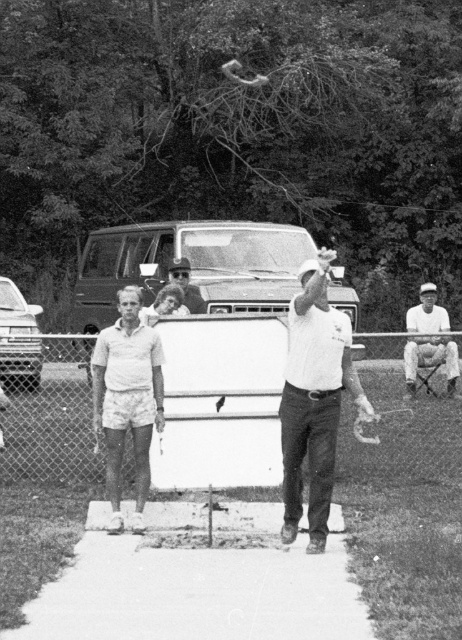
Is white fabric shirt at right bigger than smooth plastic sunglasses at center?

Actually, white fabric shirt at right might be smaller than smooth plastic sunglasses at center.

Measure the distance between point (447, 326) and camera.

Point (447, 326) and camera are 12.52 meters apart from each other.

Is point (445, 371) behind point (187, 296)?

That is True.

Locate an element on the screen. Image resolution: width=462 pixels, height=640 pixels. white fabric shirt at right is located at coordinates (429, 340).

Does chain-link fence at lower center come in front of white fabric shirt at right?

Yes, chain-link fence at lower center is closer to the viewer.

Is chain-link fence at lower center taller than white fabric shirt at right?

Indeed, chain-link fence at lower center has a greater height compared to white fabric shirt at right.

Measure the distance between point (272, 465) and camera.

A distance of 7.08 meters exists between point (272, 465) and camera.

At what (x,y) coordinates should I click in order to perform the action: click on chain-link fence at lower center. Please return your answer as a coordinate pair (x, y). The height and width of the screenshot is (640, 462). Looking at the image, I should click on (220, 403).

Is point (119, 392) in front of point (184, 305)?

Yes, it is.

Who is higher up, white cotton shorts at center or smooth plastic sunglasses at center?

Positioned higher is smooth plastic sunglasses at center.

Locate an element on the screen. This screenshot has width=462, height=640. white cotton shorts at center is located at coordinates pos(127,397).

At what (x,y) coordinates should I click in order to perform the action: click on white cotton shorts at center. Please return your answer as a coordinate pair (x, y). The height and width of the screenshot is (640, 462). Looking at the image, I should click on (127, 397).